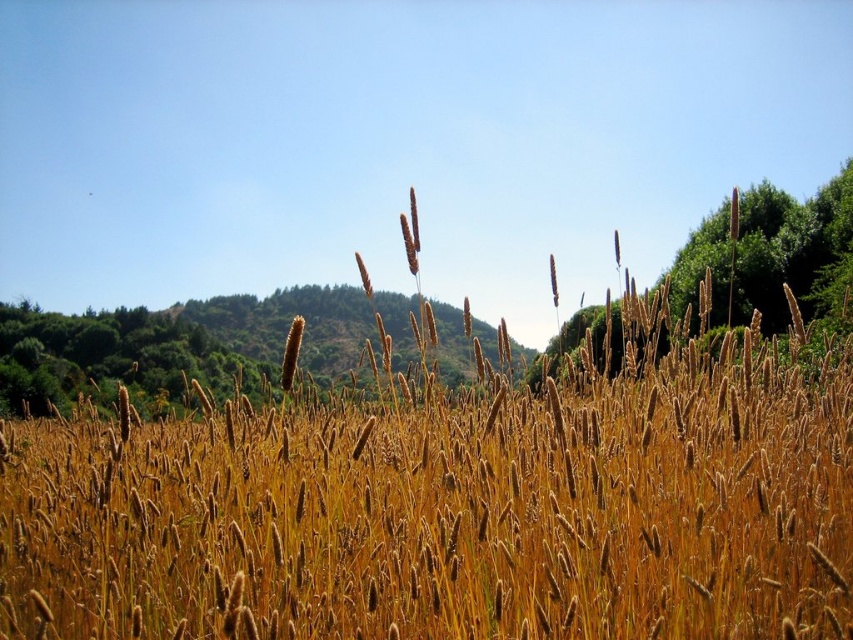
Question: Is the position of golden matte wheat field at center more distant than that of green leafy tree at upper right?

Choices:
 (A) no
 (B) yes

Answer: (A)

Question: Which of the following is the closest to the observer?

Choices:
 (A) (793, 243)
 (B) (397, 433)

Answer: (B)

Question: Is golden matte wheat field at center further to the viewer compared to green leafy tree at upper right?

Choices:
 (A) yes
 (B) no

Answer: (B)

Question: Which point is closer to the camera?

Choices:
 (A) (247, 564)
 (B) (746, 236)

Answer: (A)

Question: From the image, what is the correct spatial relationship of golden matte wheat field at center in relation to green leafy tree at upper right?

Choices:
 (A) right
 (B) left

Answer: (B)